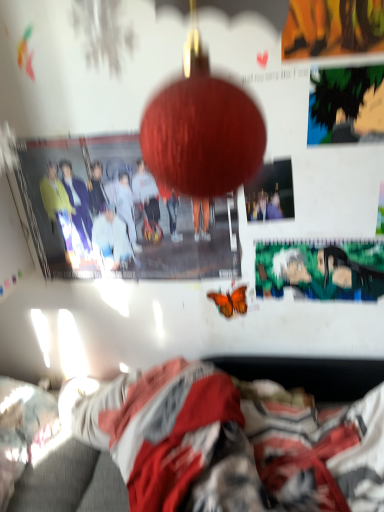
Describe the element at coordinates (22, 429) in the screenshot. I see `fluffy white pillow at lower left` at that location.

The image size is (384, 512). What do you see at coordinates (230, 301) in the screenshot?
I see `orange matte butterfly at center` at bounding box center [230, 301].

Identify the location of fluffy blanket at lower center. (229, 442).

Find the location of a particular element. The height and width of the screenshot is (512, 384). fluffy white pillow at lower left is located at coordinates (22, 429).

What's the angular difference between green matte poster at center, which ranks as the 3th poster page in top-to-bottom order, and fluffy blanket at lower center's facing directions?

The angular difference between green matte poster at center, which ranks as the 3th poster page in top-to-bottom order, and fluffy blanket at lower center is 91.3 degrees.

Between green matte poster at center, which ranks as the 3th poster page in front-to-back order, and fluffy blanket at lower center, which one has smaller size?

green matte poster at center, which ranks as the 3th poster page in front-to-back order, is smaller.

From the image's perspective, is green matte poster at center, which ranks as the 3th poster page in top-to-bottom order, over fluffy blanket at lower center?

Yes, from the image's perspective, green matte poster at center, which ranks as the 3th poster page in top-to-bottom order, is on top of fluffy blanket at lower center.

Considering the positions of points (319, 277) and (268, 407), is point (319, 277) farther from camera compared to point (268, 407)?

Yes.

Is matte paper poster at center, which ranks as the second poster page in front-to-back order, further to camera compared to green matte poster at upper right, placed as the 3th poster page when sorted from back to front?

Yes, the depth of matte paper poster at center, which ranks as the second poster page in front-to-back order, is greater than that of green matte poster at upper right, placed as the 3th poster page when sorted from back to front.

In the scene shown: Is matte paper poster at center, the second poster page viewed from the top, facing towards green matte poster at upper right, the first poster page in the top-to-bottom sequence?

No, matte paper poster at center, the second poster page viewed from the top, does not turn towards green matte poster at upper right, the first poster page in the top-to-bottom sequence.

From a real-world perspective, between matte paper poster at center, which is counted as the second poster page, starting from the bottom, and green matte poster at upper right, the first poster page in the top-to-bottom sequence, who is vertically lower?

matte paper poster at center, which is counted as the second poster page, starting from the bottom, is physically lower.

Is point (292, 214) positioned behind point (338, 96)?

Yes.

From the image's perspective, which one is positioned higher, fluffy white pillow at lower left or orange matte butterfly at center?

orange matte butterfly at center appears higher in the image.

Is point (11, 477) more distant than point (222, 294)?

No, (11, 477) is closer to viewer.

Is fluffy white pillow at lower left shorter than orange matte butterfly at center?

No, fluffy white pillow at lower left is not shorter than orange matte butterfly at center.

Does fluffy white pillow at lower left appear on the left side of orange matte butterfly at center?

Indeed, fluffy white pillow at lower left is positioned on the left side of orange matte butterfly at center.

Is green matte poster at center, positioned as the first poster page in bottom-to-top order, beside matte paper poster at center, the second poster page viewed from the top?

No, green matte poster at center, positioned as the first poster page in bottom-to-top order, is not touching matte paper poster at center, the second poster page viewed from the top.

From a real-world perspective, who is located lower, green matte poster at center, which ranks as the 3th poster page in top-to-bottom order, or matte paper poster at center, the second poster page viewed from the top?

green matte poster at center, which ranks as the 3th poster page in top-to-bottom order, from a real-world perspective.

Does green matte poster at center, which ranks as the 3th poster page in front-to-back order, have a lesser height compared to matte paper poster at center, which ranks as the second poster page in front-to-back order?

In fact, green matte poster at center, which ranks as the 3th poster page in front-to-back order, may be taller than matte paper poster at center, which ranks as the second poster page in front-to-back order.

Is orange matte butterfly at center positioned with its back to green matte poster at center, which ranks as the 3th poster page in front-to-back order?

orange matte butterfly at center is not turned away from green matte poster at center, which ranks as the 3th poster page in front-to-back order.

Considering the sizes of objects orange matte butterfly at center and green matte poster at center, which ranks as the 3th poster page in front-to-back order, in the image provided, who is smaller, orange matte butterfly at center or green matte poster at center, which ranks as the 3th poster page in front-to-back order,?

Smaller between the two is orange matte butterfly at center.

Between orange matte butterfly at center and green matte poster at center, positioned as the first poster page in bottom-to-top order, which one is positioned behind?

orange matte butterfly at center is further away from the camera.

Can you confirm if orange matte butterfly at center is thinner than green matte poster at center, which ranks as the 3th poster page in top-to-bottom order?

In fact, orange matte butterfly at center might be wider than green matte poster at center, which ranks as the 3th poster page in top-to-bottom order.

Is matte paper poster at center, which ranks as the second poster page in front-to-back order, oriented towards orange matte butterfly at center?

No, matte paper poster at center, which ranks as the second poster page in front-to-back order, is not aimed at orange matte butterfly at center.

Considering their positions, is matte paper poster at center, which is counted as the second poster page, starting from the bottom, located in front of or behind orange matte butterfly at center?

matte paper poster at center, which is counted as the second poster page, starting from the bottom, is in front of orange matte butterfly at center.

Does matte paper poster at center, which ranks as the second poster page in front-to-back order, have a smaller size compared to orange matte butterfly at center?

Actually, matte paper poster at center, which ranks as the second poster page in front-to-back order, might be larger than orange matte butterfly at center.

In the scene shown: Would you say orange matte butterfly at center is part of matte paper poster at center, the second poster page viewed from the top,'s contents?

No.

Consider the image. How much distance is there between fluffy blanket at lower center and green matte poster at center, positioned as the first poster page in bottom-to-top order?

They are 19.23 inches apart.

Is fluffy blanket at lower center in front of or behind green matte poster at center, which ranks as the 3th poster page in top-to-bottom order, in the image?

Visually, fluffy blanket at lower center is located in front of green matte poster at center, which ranks as the 3th poster page in top-to-bottom order.

Between fluffy blanket at lower center and green matte poster at center, which ranks as the 3th poster page in top-to-bottom order, which one has larger width?

fluffy blanket at lower center is wider.

How different are the orientations of fluffy blanket at lower center and green matte poster at center, which ranks as the 3th poster page in front-to-back order, in degrees?

There is a 91.3-degree angle between the facing directions of fluffy blanket at lower center and green matte poster at center, which ranks as the 3th poster page in front-to-back order.

Where is `the 1st poster page directly above the fluffy blanket at lower center (from a real-world perspective)`? the 1st poster page directly above the fluffy blanket at lower center (from a real-world perspective) is located at coordinates (321, 269).

Locate an element on the screen. This screenshot has width=384, height=512. the 2nd poster page to the left when counting from the green matte poster at upper right, the first poster page in the top-to-bottom sequence is located at coordinates (271, 193).

Based on their spatial positions, is fluffy blanket at lower center or fluffy white pillow at lower left further from green matte poster at upper right, arranged as the 3th poster page when ordered from the bottom?

Based on the image, fluffy white pillow at lower left appears to be further to green matte poster at upper right, arranged as the 3th poster page when ordered from the bottom.

From the image, which object appears to be farther from matte paper poster at center, the second poster page viewed from the top, fluffy white pillow at lower left or green matte poster at center, the 1th poster page from the back?

Based on the image, fluffy white pillow at lower left appears to be further to matte paper poster at center, the second poster page viewed from the top.

Estimate the real-world distances between objects in this image. Which object is closer to orange matte butterfly at center, green matte poster at upper right, which is the 1th poster page from front to back, or matte paper poster at center, which is counted as the second poster page, starting from the bottom?

Based on the image, matte paper poster at center, which is counted as the second poster page, starting from the bottom, appears to be nearer to orange matte butterfly at center.

Which object lies further to the anchor point orange matte butterfly at center, fluffy blanket at lower center or fluffy white pillow at lower left?

fluffy white pillow at lower left is positioned further to the anchor orange matte butterfly at center.

Estimate the real-world distances between objects in this image. Which object is closer to green matte poster at center, the 1th poster page from the back, green matte poster at upper right, arranged as the 3th poster page when ordered from the bottom, or fluffy blanket at lower center?

green matte poster at upper right, arranged as the 3th poster page when ordered from the bottom, is closer to green matte poster at center, the 1th poster page from the back.

Estimate the real-world distances between objects in this image. Which object is further from orange matte butterfly at center, matte paper poster at center, positioned as the second poster page in back-to-front order, or fluffy blanket at lower center?

Based on the image, fluffy blanket at lower center appears to be further to orange matte butterfly at center.

Looking at the image, which one is located further to fluffy blanket at lower center, green matte poster at center, which ranks as the 3th poster page in front-to-back order, or matte paper poster at center, which ranks as the second poster page in front-to-back order?

matte paper poster at center, which ranks as the second poster page in front-to-back order, is positioned further to the anchor fluffy blanket at lower center.

Considering their positions, is fluffy white pillow at lower left positioned closer to fluffy blanket at lower center than orange matte butterfly at center?

fluffy white pillow at lower left is positioned closer to the anchor fluffy blanket at lower center.

At what (x,y) coordinates should I click in order to perform the action: click on butterfly between green matte poster at center, positioned as the first poster page in bottom-to-top order, and fluffy blanket at lower center vertically. Please return your answer as a coordinate pair (x, y). Looking at the image, I should click on (230, 301).

Identify the location of poster page between matte paper poster at center, positioned as the second poster page in back-to-front order, and orange matte butterfly at center from top to bottom. The height and width of the screenshot is (512, 384). (321, 269).

Identify the location of butterfly that lies between green matte poster at upper right, arranged as the 3th poster page when ordered from the bottom, and fluffy blanket at lower center from top to bottom. (230, 301).

I want to click on poster page between matte paper poster at center, the second poster page viewed from the top, and fluffy blanket at lower center, in the vertical direction, so click(321, 269).